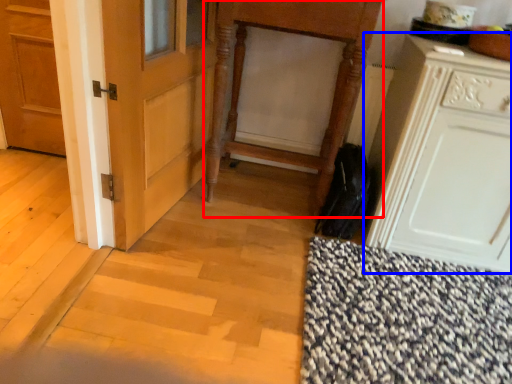
Question: Which point is closer to the camera, vanity (highlighted by a red box) or cabinetry (highlighted by a blue box)?

Choices:
 (A) vanity
 (B) cabinetry

Answer: (B)